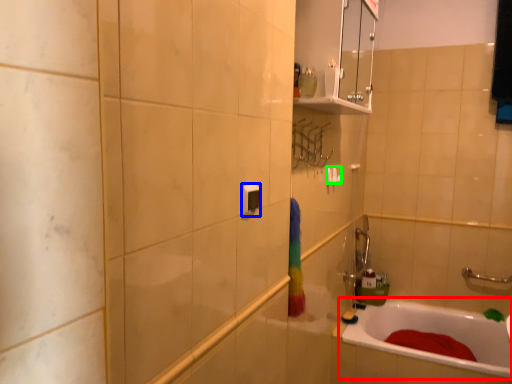
Question: Which object is positioned farthest from bathtub (highlighted by a red box)? Select from light switch (highlighted by a blue box) and towel bar (highlighted by a green box).

Choices:
 (A) light switch
 (B) towel bar

Answer: (A)